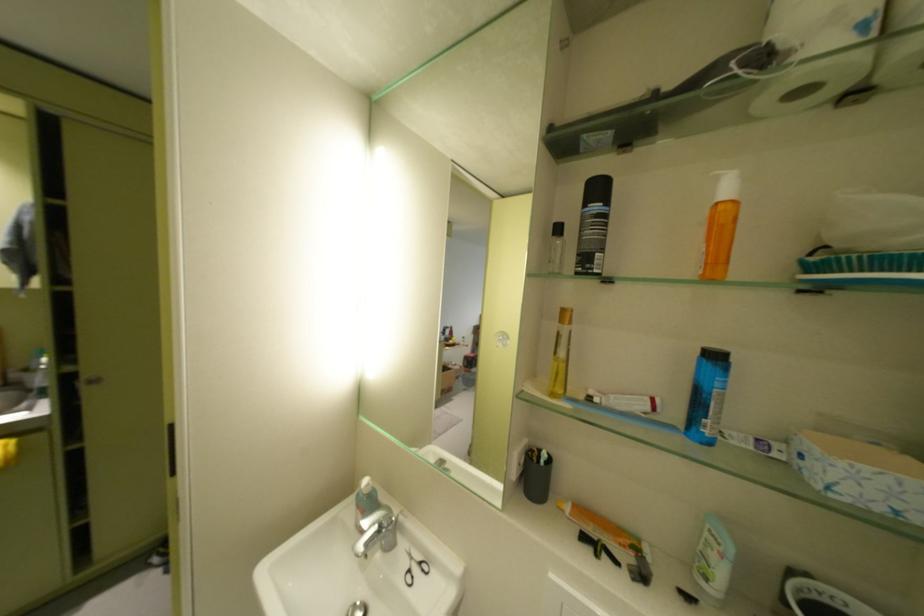
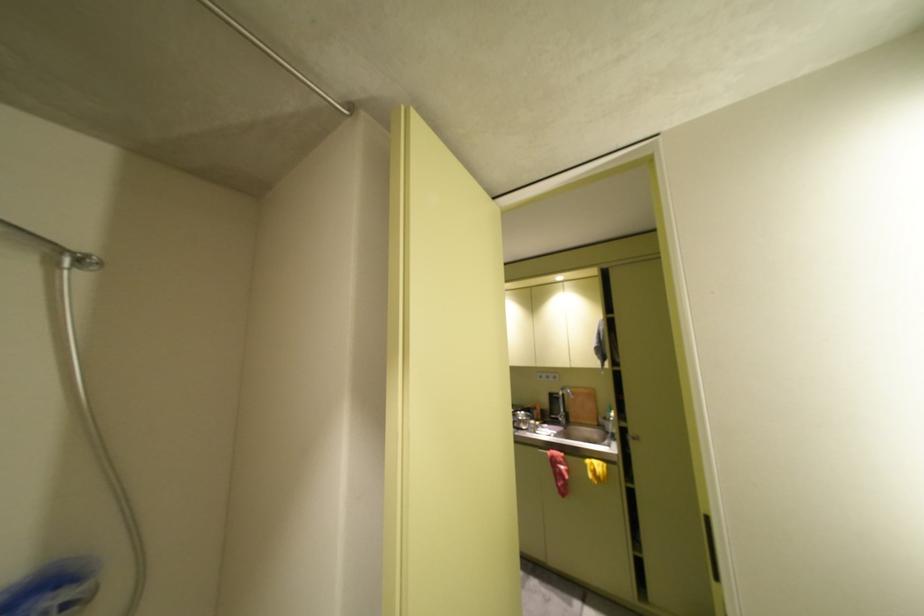
Question: The camera is either moving clockwise (left) or counter-clockwise (right) around the object. The first image is from the beginning of the video and the second image is from the end. Is the camera moving left or right when shooting the video?

Choices:
 (A) Left
 (B) Right

Answer: (B)